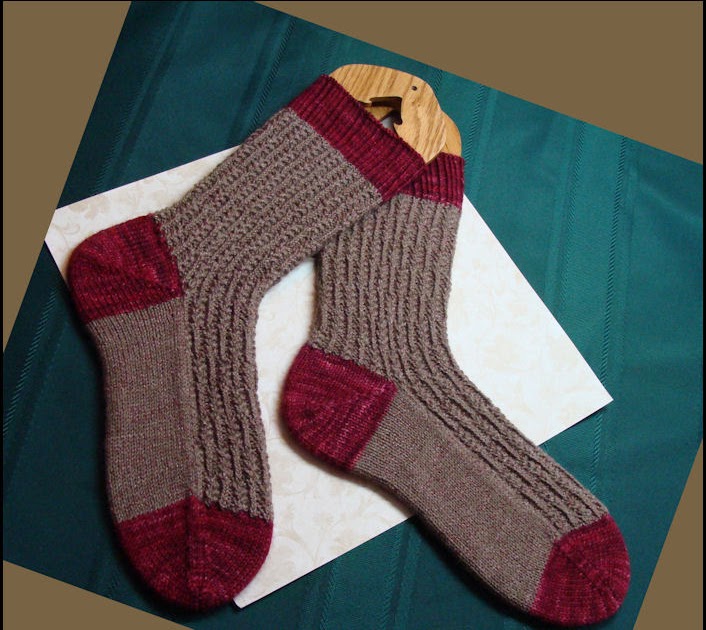
This screenshot has height=630, width=706. What are the coordinates of `fabric placemat` in the screenshot? It's located at (669, 162).